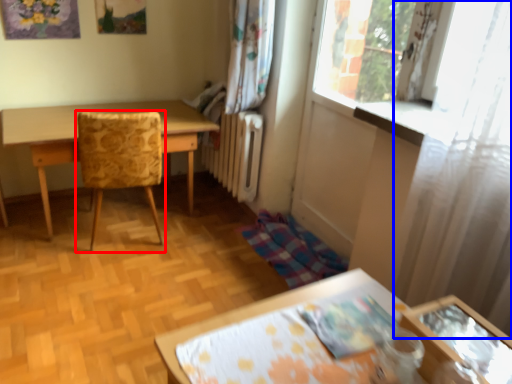
Question: Which object appears closest to the camera in this image, chair (highlighted by a red box) or curtain (highlighted by a blue box)?

Choices:
 (A) chair
 (B) curtain

Answer: (B)